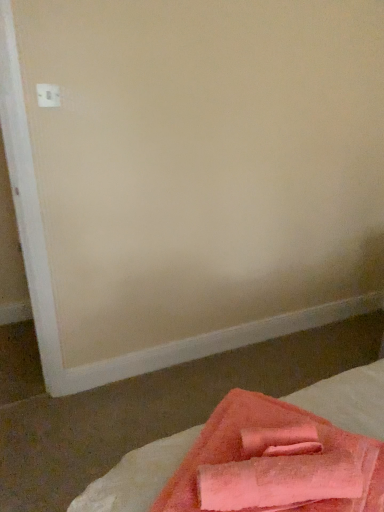
Question: From the image's perspective, is pink terry cloth towel at lower right above white plastic electric outlet at upper left?

Choices:
 (A) yes
 (B) no

Answer: (B)

Question: Is pink terry cloth towel at lower right aimed at white plastic electric outlet at upper left?

Choices:
 (A) no
 (B) yes

Answer: (A)

Question: Is the position of pink terry cloth towel at lower right more distant than that of white plastic electric outlet at upper left?

Choices:
 (A) yes
 (B) no

Answer: (B)

Question: Does pink terry cloth towel at lower right have a lesser width compared to white plastic electric outlet at upper left?

Choices:
 (A) no
 (B) yes

Answer: (A)

Question: Considering the relative positions of pink terry cloth towel at lower right and white plastic electric outlet at upper left in the image provided, is pink terry cloth towel at lower right to the right of white plastic electric outlet at upper left from the viewer's perspective?

Choices:
 (A) yes
 (B) no

Answer: (A)

Question: Is the position of pink terry cloth towel at lower right less distant than that of white plastic electric outlet at upper left?

Choices:
 (A) no
 (B) yes

Answer: (B)

Question: Does soft pink towel at lower right lie in front of pink terry cloth towel at lower right?

Choices:
 (A) no
 (B) yes

Answer: (B)

Question: Does soft pink towel at lower right have a greater height compared to pink terry cloth towel at lower right?

Choices:
 (A) no
 (B) yes

Answer: (B)

Question: Is soft pink towel at lower right behind pink terry cloth towel at lower right?

Choices:
 (A) yes
 (B) no

Answer: (B)

Question: Can you confirm if soft pink towel at lower right is wider than pink terry cloth towel at lower right?

Choices:
 (A) yes
 (B) no

Answer: (A)

Question: Are soft pink towel at lower right and pink terry cloth towel at lower right making contact?

Choices:
 (A) no
 (B) yes

Answer: (A)

Question: Can you confirm if soft pink towel at lower right is shorter than pink terry cloth towel at lower right?

Choices:
 (A) yes
 (B) no

Answer: (B)

Question: From the image's perspective, is pink terry cloth towel at lower right under soft pink towel at lower right?

Choices:
 (A) no
 (B) yes

Answer: (A)